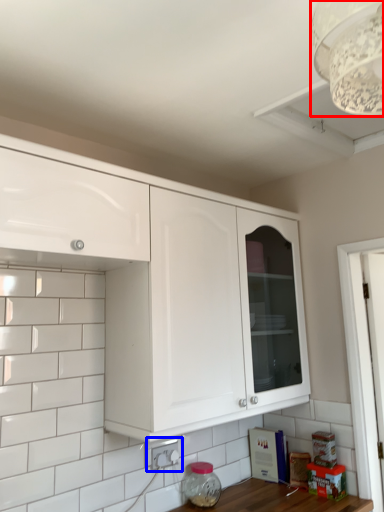
Question: Which of the following is the closest to the observer, light fixture (highlighted by a red box) or electric outlet (highlighted by a blue box)?

Choices:
 (A) light fixture
 (B) electric outlet

Answer: (A)